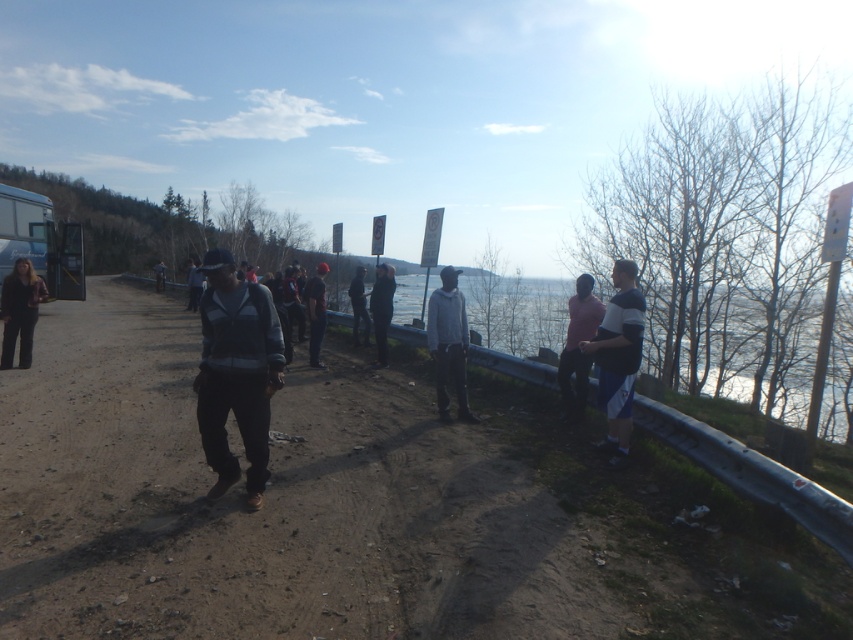
Who is higher up, pink matte shirt at center or dark blue jeans at center?

dark blue jeans at center

Is pink matte shirt at center thinner than dark blue jeans at center?

Indeed, pink matte shirt at center has a lesser width compared to dark blue jeans at center.

Which is behind, point (577, 310) or point (312, 292)?

Point (312, 292)

Image resolution: width=853 pixels, height=640 pixels. I want to click on pink matte shirt at center, so click(x=577, y=348).

Does point (225, 372) come farther from viewer compared to point (593, 314)?

That is False.

Based on the photo, can you confirm if dark gray fleece jacket at center is taller than pink matte shirt at center?

Yes.

Describe the element at coordinates (236, 372) in the screenshot. I see `dark gray fleece jacket at center` at that location.

The height and width of the screenshot is (640, 853). What are the coordinates of `dark gray fleece jacket at center` in the screenshot? It's located at (x=236, y=372).

Looking at this image, who is more forward, (462, 380) or (375, 280)?

Point (462, 380) is in front.

What do you see at coordinates (448, 342) in the screenshot? The height and width of the screenshot is (640, 853). I see `gray matte jacket at center` at bounding box center [448, 342].

Is point (463, 320) positioned behind point (378, 344)?

No, it is in front of (378, 344).

At what (x,y) coordinates should I click in order to perform the action: click on gray matte jacket at center. Please return your answer as a coordinate pair (x, y). The width and height of the screenshot is (853, 640). Looking at the image, I should click on (448, 342).